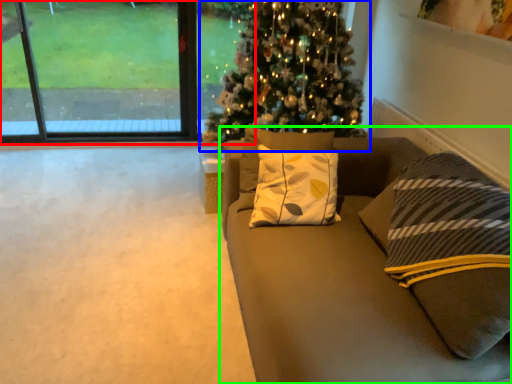
Question: Estimate the real-world distances between objects in this image. Which object is closer to window (highlighted by a red box), christmas tree (highlighted by a blue box) or studio couch (highlighted by a green box)?

Choices:
 (A) christmas tree
 (B) studio couch

Answer: (A)